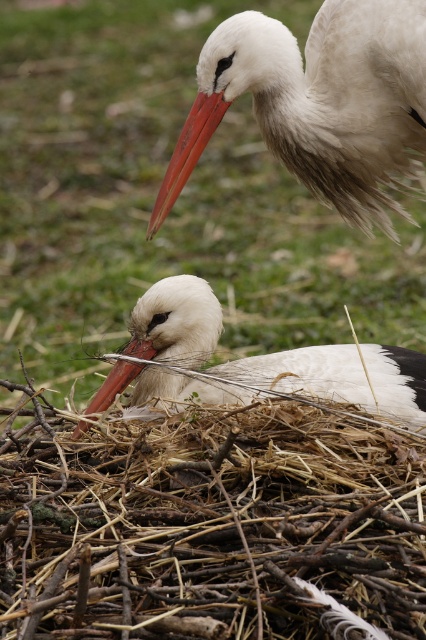
Measure the distance between green grass at center and white matte bird at center.

They are 3.07 meters apart.

Between green grass at center and white matte bird at center, which one has more height?

Standing taller between the two is green grass at center.

Is point (36, 177) positioned after point (173, 356)?

Yes, it is behind point (173, 356).

The width and height of the screenshot is (426, 640). Identify the location of green grass at center. (155, 196).

Does brown straw nest at lower center have a greater height compared to matte orange beak at center?

Indeed, brown straw nest at lower center has a greater height compared to matte orange beak at center.

Which of these two, brown straw nest at lower center or matte orange beak at center, stands shorter?

Standing shorter between the two is matte orange beak at center.

Between point (132, 516) and point (95, 397), which one is positioned in front?

Point (132, 516)

Where is `brown straw nest at lower center`? This screenshot has height=640, width=426. brown straw nest at lower center is located at coordinates point(210,524).

Who is positioned more to the left, brown straw nest at lower center or white matte bird at center?

From the viewer's perspective, brown straw nest at lower center appears more on the left side.

Can you confirm if brown straw nest at lower center is smaller than white matte bird at center?

No.

In order to click on brown straw nest at lower center in this screenshot , I will do `click(210, 524)`.